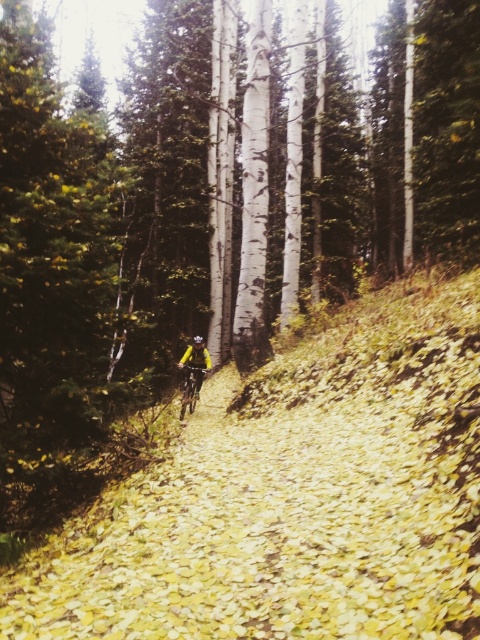
Can you confirm if yellow fabric jacket at center is positioned below yellow matte helmet at center?

Yes.

Does yellow fabric jacket at center lie in front of yellow matte helmet at center?

Yes, yellow fabric jacket at center is closer to the viewer.

Who is more distant from viewer, (199, 369) or (201, 342)?

The point (199, 369) is behind.

This screenshot has height=640, width=480. Find the location of `yellow fabric jacket at center`. yellow fabric jacket at center is located at coordinates (195, 362).

Between yellow fabric jacket at center and yellow matte bicycle at center, which one appears on the left side from the viewer's perspective?

From the viewer's perspective, yellow matte bicycle at center appears more on the left side.

Does yellow fabric jacket at center have a lesser height compared to yellow matte bicycle at center?

In fact, yellow fabric jacket at center may be taller than yellow matte bicycle at center.

Describe the element at coordinates (195, 362) in the screenshot. Image resolution: width=480 pixels, height=640 pixels. I see `yellow fabric jacket at center` at that location.

At what (x,y) coordinates should I click in order to perform the action: click on yellow fabric jacket at center. Please return your answer as a coordinate pair (x, y). The width and height of the screenshot is (480, 640). Looking at the image, I should click on pyautogui.click(x=195, y=362).

Can you confirm if yellow matte bicycle at center is taller than yellow matte helmet at center?

Yes.

Can you confirm if yellow matte bicycle at center is shorter than yellow matte helmet at center?

In fact, yellow matte bicycle at center may be taller than yellow matte helmet at center.

Is point (188, 396) less distant than point (199, 336)?

That is True.

What are the coordinates of `yellow matte bicycle at center` in the screenshot? It's located at (x=191, y=387).